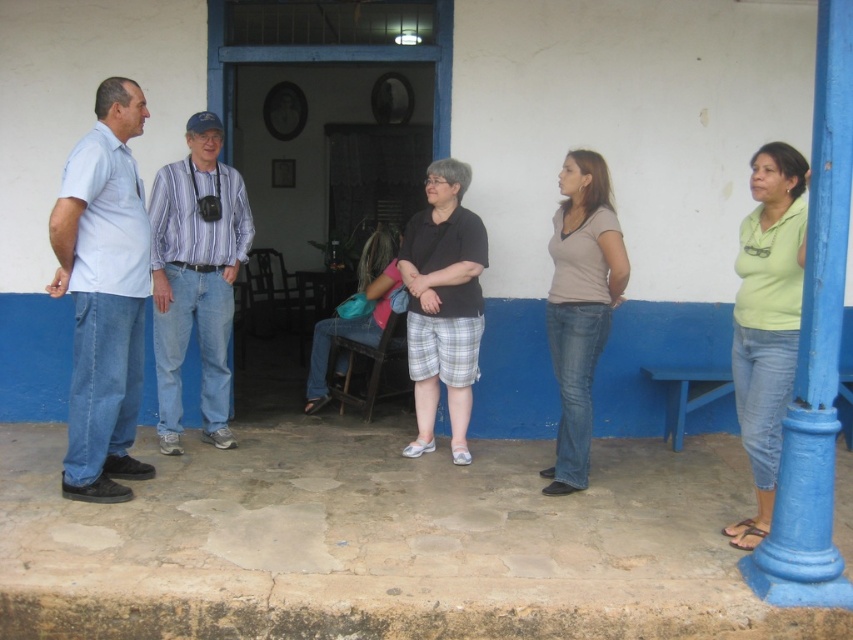
Question: Does striped cotton shirt at center appear under black cotton shirt at center?

Choices:
 (A) no
 (B) yes

Answer: (A)

Question: Which point is closer to the camera taking this photo?

Choices:
 (A) (828, 426)
 (B) (105, 483)
 (C) (210, 317)

Answer: (A)

Question: Observing the image, what is the correct spatial positioning of blue painted metal pole at right in reference to pink fabric at center?

Choices:
 (A) below
 (B) above

Answer: (A)

Question: Which object is positioned closest to the blue painted metal pole at right?

Choices:
 (A) black cotton shirt at center
 (B) striped cotton shirt at center
 (C) green matte shirt at right
 (D) matte brown shirt at center

Answer: (C)

Question: Which point is closer to the camera?

Choices:
 (A) pink fabric at center
 (B) black cotton shirt at center
 (C) blue painted metal pole at right
 (D) matte brown shirt at center

Answer: (C)

Question: Observing the image, what is the correct spatial positioning of light blue cotton shirt at left in reference to green matte shirt at right?

Choices:
 (A) left
 (B) right

Answer: (A)